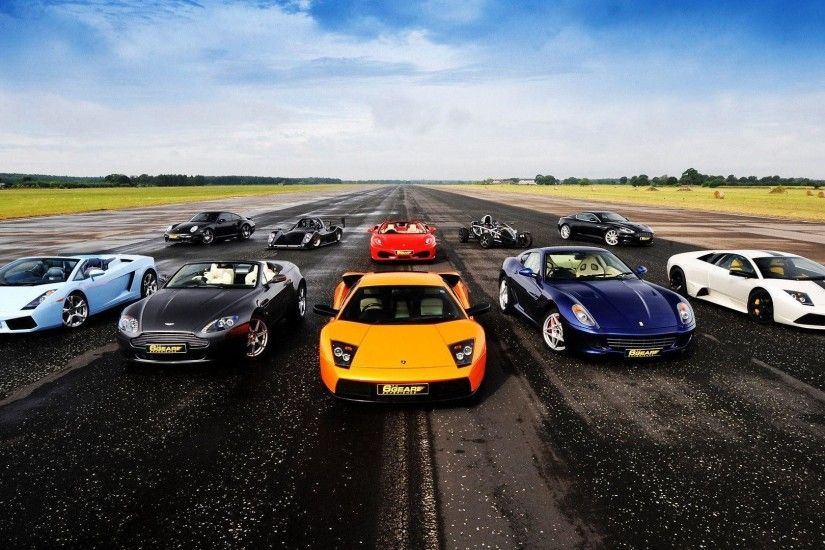
Where is `hoods`? The height and width of the screenshot is (550, 825). hoods is located at coordinates (184, 311), (390, 343), (627, 307), (816, 295), (13, 300), (181, 229), (294, 236), (403, 240), (510, 233), (639, 229).